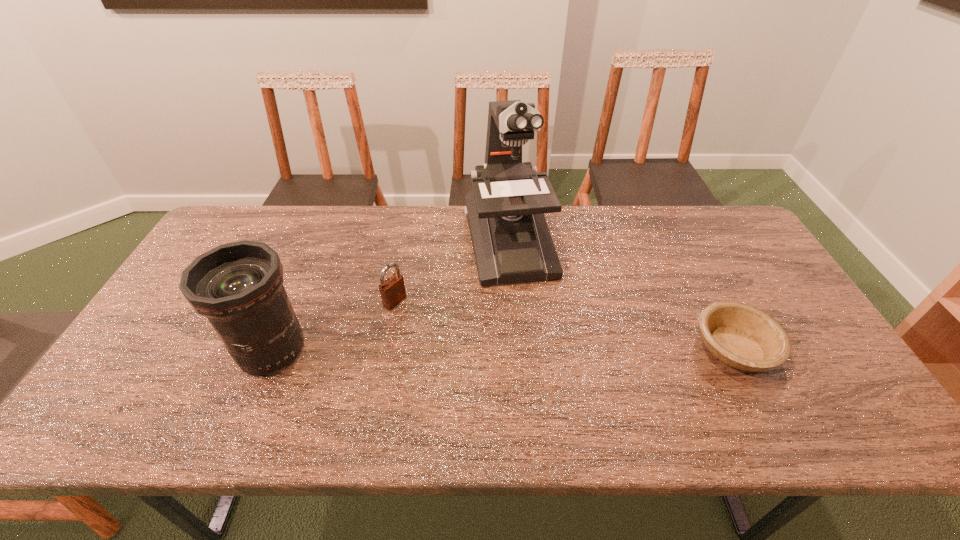
At what (x,y) coordinates should I click in order to perform the action: click on object present at the near right corner. Please return your answer as a coordinate pair (x, y). This screenshot has height=540, width=960. Looking at the image, I should click on (741, 336).

This screenshot has width=960, height=540. In the image, there is a desktop. Find the location of `free space at the far edge`. free space at the far edge is located at coordinates (380, 247).

In the image, there is a desktop. At what (x,y) coordinates should I click in order to perform the action: click on vacant region at the near edge. Please return your answer as a coordinate pair (x, y). Image resolution: width=960 pixels, height=540 pixels. Looking at the image, I should click on (428, 376).

The image size is (960, 540). In order to click on blank space at the left edge in this screenshot , I will do `click(196, 319)`.

Locate an element on the screen. This screenshot has width=960, height=540. vacant area that lies between the bowl and the tallest object is located at coordinates (621, 295).

Where is `unoccupied area between the microscope and the bowl`? The width and height of the screenshot is (960, 540). unoccupied area between the microscope and the bowl is located at coordinates pos(621,295).

Identify the location of vacant space that is in between the third object from left to right and the second farthest object. (452, 272).

The image size is (960, 540). Identify the location of free space between the third object from left to right and the bowl. (621, 295).

You are a GUI agent. You are given a task and a screenshot of the screen. Output one action in this format:
    pyautogui.click(x=<x>, y=<y>)
    Task: Click on the empty space that is in between the telephoto lens and the second shortest object
    
    Given the screenshot: What is the action you would take?
    pyautogui.click(x=333, y=325)

You are a GUI agent. You are given a task and a screenshot of the screen. Output one action in this format:
    pyautogui.click(x=<x>, y=<y>)
    Task: Click on the free space that is in between the bowl and the padlock
    
    Given the screenshot: What is the action you would take?
    pyautogui.click(x=564, y=325)